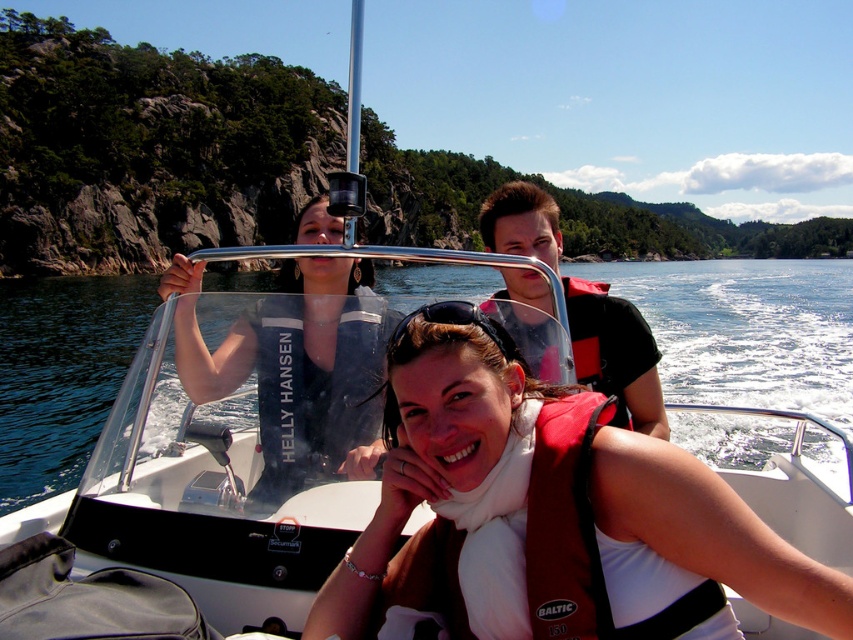
Between brown fabric life vest at center and matte black jacket at upper center, which one has less height?

brown fabric life vest at center is shorter.

Is brown fabric life vest at center positioned in front of matte black jacket at upper center?

That is True.

Which is in front, point (403, 595) or point (183, 298)?

Point (403, 595) is more forward.

Image resolution: width=853 pixels, height=640 pixels. Identify the location of brown fabric life vest at center. (550, 515).

In the scene shown: Does brown fabric life vest at center have a lesser height compared to black rubber goggles at center?

No, brown fabric life vest at center is not shorter than black rubber goggles at center.

Is point (312, 621) closer to viewer compared to point (432, 317)?

That is True.

I want to click on brown fabric life vest at center, so click(x=550, y=515).

Describe the element at coordinates (746, 330) in the screenshot. This screenshot has height=640, width=853. I see `clear blue water at center` at that location.

Identify the location of clear blue water at center. (746, 330).

Does point (21, 465) come closer to viewer compared to point (265, 424)?

No, it is behind (265, 424).

Identify the location of clear blue water at center. (746, 330).